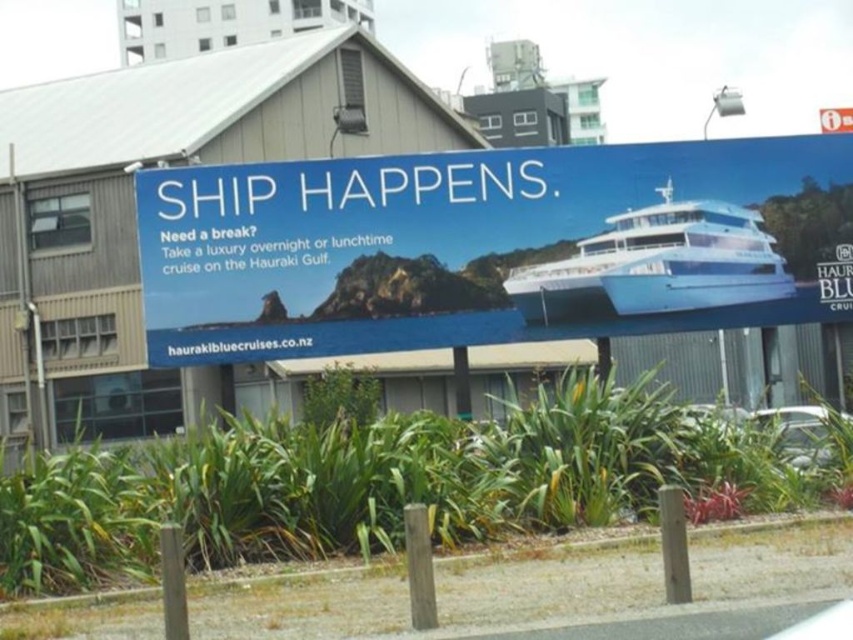
Which is more to the right, white glossy ship at upper center or white glossy boat at upper right?

white glossy boat at upper right is more to the right.

Can you confirm if white glossy ship at upper center is shorter than white glossy boat at upper right?

No, white glossy ship at upper center is not shorter than white glossy boat at upper right.

Between point (755, 148) and point (666, 260), which one is positioned in front?

Point (666, 260) is more forward.

I want to click on white glossy ship at upper center, so click(x=492, y=246).